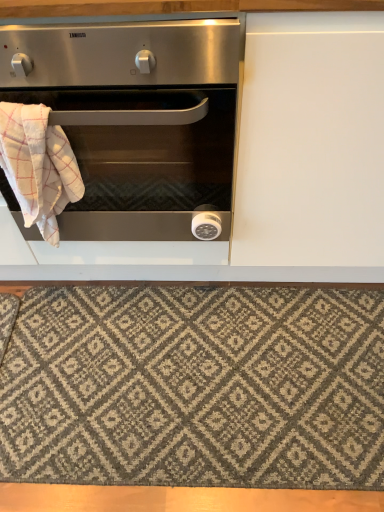
Where is `free region under textured gray rug at lower center (from a real-world perspective)`? free region under textured gray rug at lower center (from a real-world perspective) is located at coordinates (209, 393).